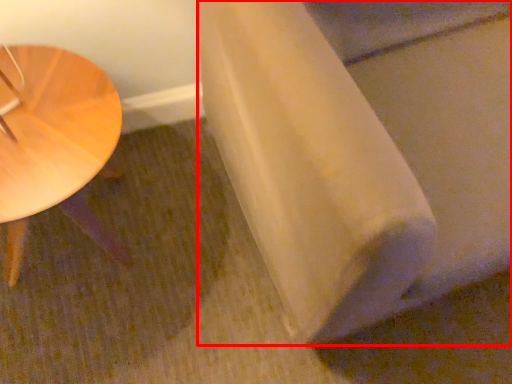
Question: From the image's perspective, what is the correct spatial relationship of linen (annotated by the red box) in relation to table?

Choices:
 (A) below
 (B) above

Answer: (B)